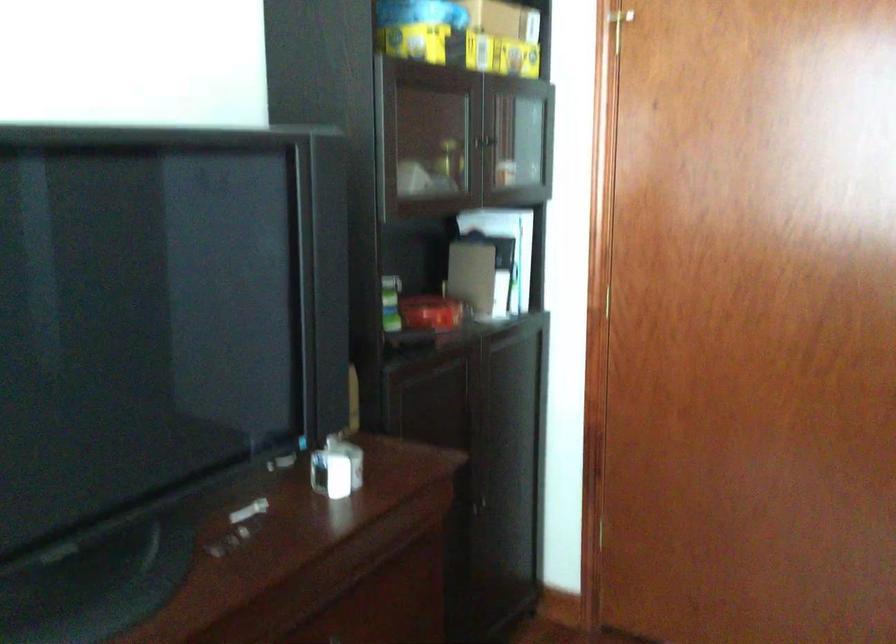
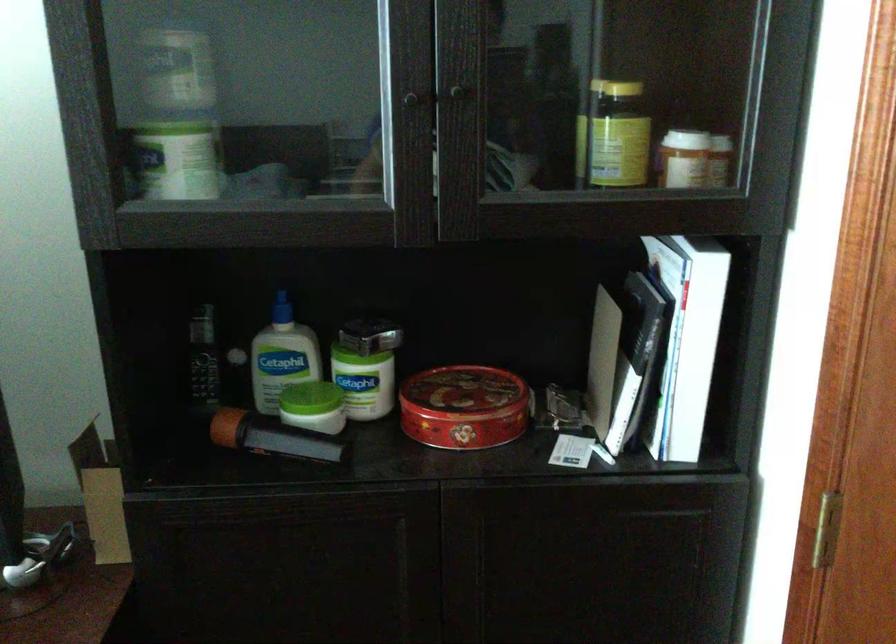
Where in the second image is the point corresponding to (479,135) from the first image?

(409, 93)